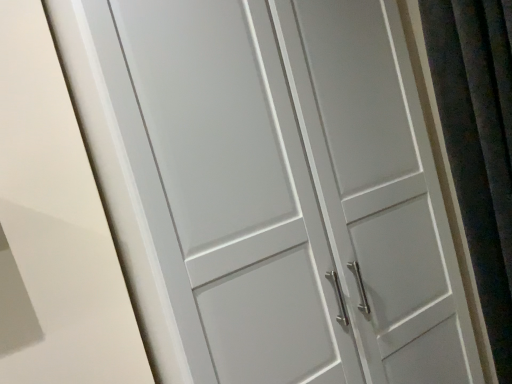
This screenshot has width=512, height=384. Describe the element at coordinates (479, 144) in the screenshot. I see `velvet dark at right` at that location.

The image size is (512, 384). Find the location of `velvet dark at right`. velvet dark at right is located at coordinates (479, 144).

This screenshot has width=512, height=384. Identify the location of velvet dark at right. (479, 144).